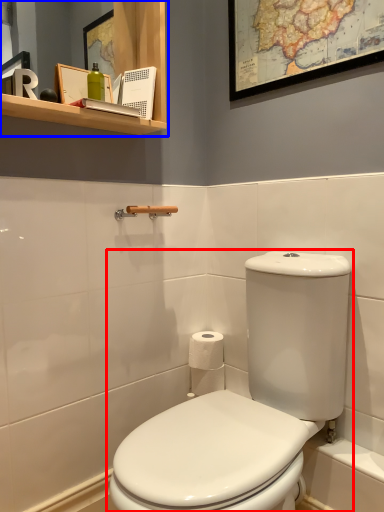
Question: Which object is closer to the camera taking this photo, toilet (highlighted by a red box) or bathroom cabinet (highlighted by a blue box)?

Choices:
 (A) toilet
 (B) bathroom cabinet

Answer: (A)